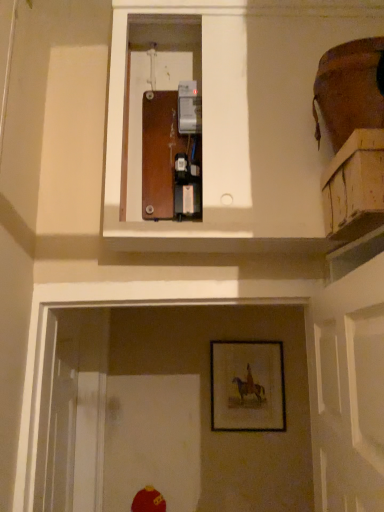
Question: From the image's perspective, is wooden crate at upper right positioned above or below wooden framed picture at lower center?

Choices:
 (A) below
 (B) above

Answer: (B)

Question: In terms of size, does wooden crate at upper right appear bigger or smaller than wooden framed picture at lower center?

Choices:
 (A) small
 (B) big

Answer: (A)

Question: Do you think wooden crate at upper right is within wooden framed picture at lower center, or outside of it?

Choices:
 (A) inside
 (B) outside

Answer: (B)

Question: Considering the positions of wooden framed picture at lower center and wooden crate at upper right in the image, is wooden framed picture at lower center wider or thinner than wooden crate at upper right?

Choices:
 (A) thin
 (B) wide

Answer: (A)

Question: Would you say wooden framed picture at lower center is to the left or to the right of wooden crate at upper right in the picture?

Choices:
 (A) left
 (B) right

Answer: (A)

Question: From the image's perspective, is wooden framed picture at lower center above or below wooden crate at upper right?

Choices:
 (A) above
 (B) below

Answer: (B)

Question: Do you think wooden framed picture at lower center is within wooden crate at upper right, or outside of it?

Choices:
 (A) outside
 (B) inside

Answer: (A)